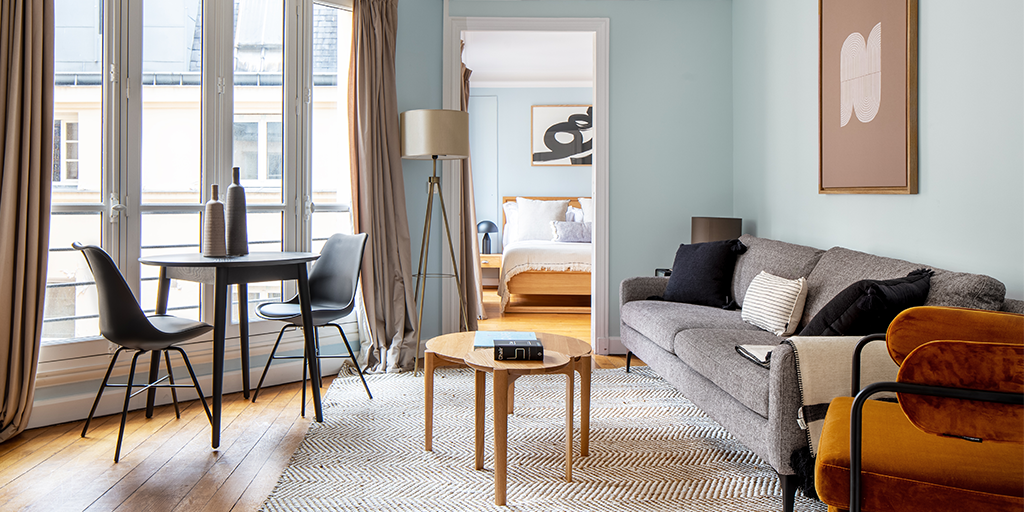
Find the location of a particular element. Image resolution: width=1024 pixels, height=512 pixels. books is located at coordinates (519, 345), (486, 344).